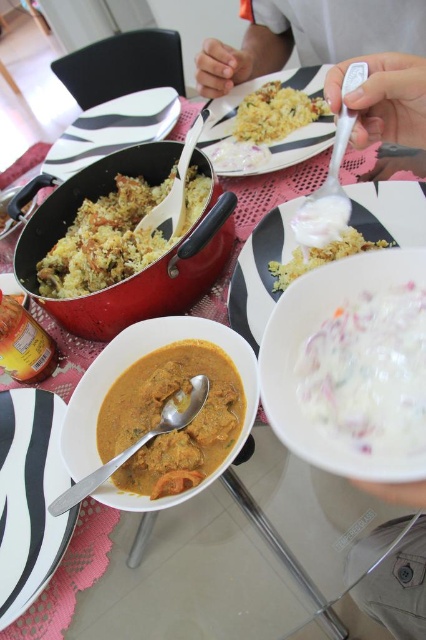
Is white creamy salad at center in front of black glossy plate at center?

Yes.

Is white creamy salad at center further to camera compared to black glossy plate at center?

No, white creamy salad at center is closer to the viewer.

What do you see at coordinates (368, 371) in the screenshot? Image resolution: width=426 pixels, height=640 pixels. I see `white creamy salad at center` at bounding box center [368, 371].

At what (x,y) coordinates should I click in order to perform the action: click on white creamy salad at center. Please return your answer as a coordinate pair (x, y). This screenshot has height=640, width=426. Looking at the image, I should click on (368, 371).

Who is positioned more to the left, white matte plate at center or yellow rice at center?

From the viewer's perspective, yellow rice at center appears more on the left side.

Is point (405, 205) more distant than point (256, 97)?

No, it is not.

Where is `white matte plate at center`? The image size is (426, 640). white matte plate at center is located at coordinates (259, 273).

Is point (49, 419) farther from viewer compared to point (230, 300)?

No, (49, 419) is closer to viewer.

Who is positioned more to the right, black glossy plate at center or white matte plate at center?

From the viewer's perspective, white matte plate at center appears more on the right side.

Which is in front, point (8, 417) or point (245, 337)?

Point (245, 337)

The width and height of the screenshot is (426, 640). What are the coordinates of `black glossy plate at center` in the screenshot? It's located at (29, 497).